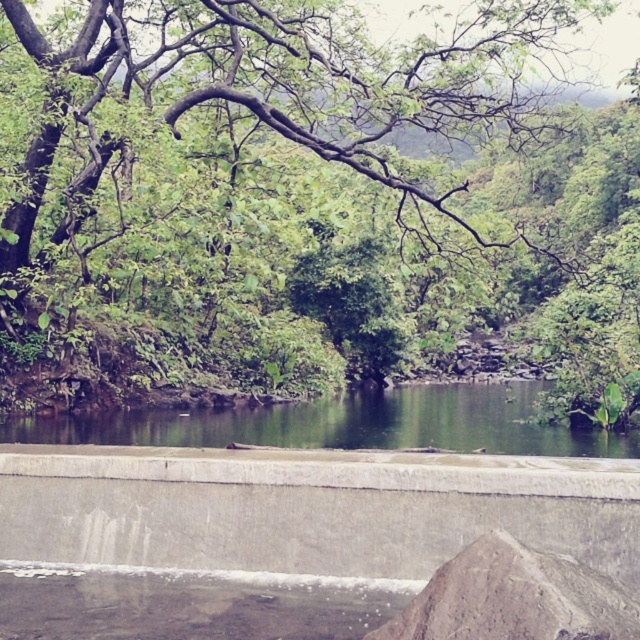
You are an environmental scientist assessing the scene. You need to determine which object occupies a wider area in the image between the green leafy tree at upper center and the green smooth water at center. Which one is wider?

The green leafy tree at upper center is wider than the green smooth water at center according to the description.

You are an architect designing a new park layout and need to place a new bench. You have a map of the area showing the green leafy tree at upper center. According to the map, where should you place the bench so that it is exactly 0.1 units to the right of the tree?

The green leafy tree at upper center is located at point (253, 184). To place the bench exactly 0.1 units to the right, the coordinates would be (253, 248).